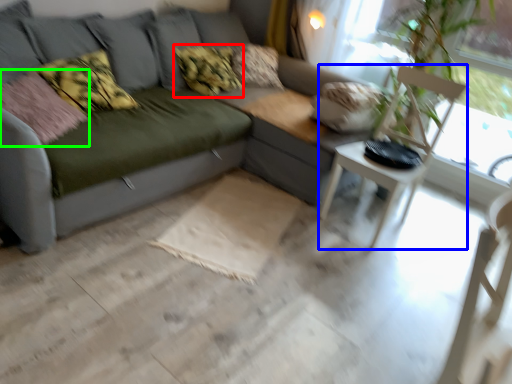
Question: Estimate the real-world distances between objects in this image. Which object is closer to pillow (highlighted by a red box), armchair (highlighted by a blue box) or pillow (highlighted by a green box)?

Choices:
 (A) armchair
 (B) pillow

Answer: (B)